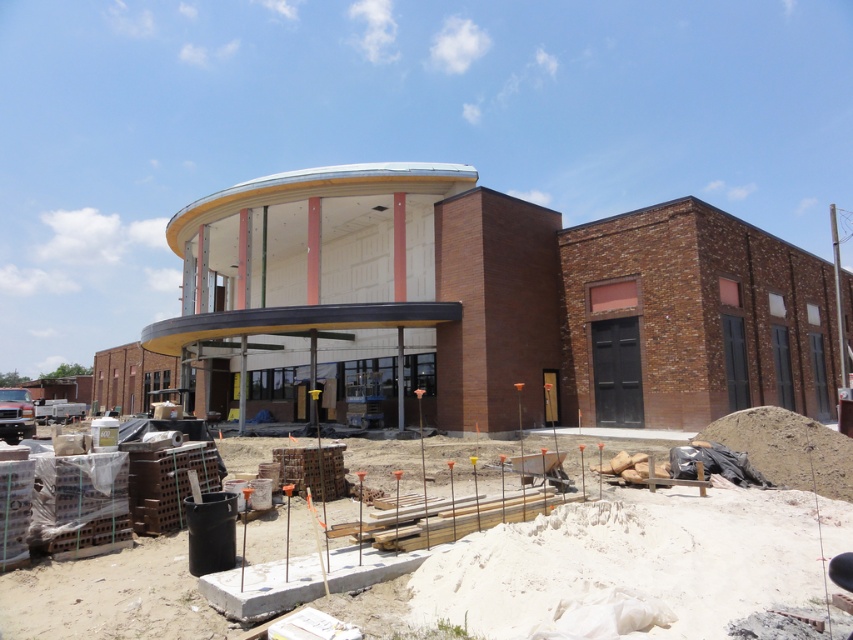
You are an architect visiting the construction site and need to determine the spatial relationship between the white smooth building at center and the concrete blocks at lower left. Which object occupies a greater area in the image?

The white smooth building at center is larger in size than the concrete blocks at lower left, so it occupies a greater area in the image.